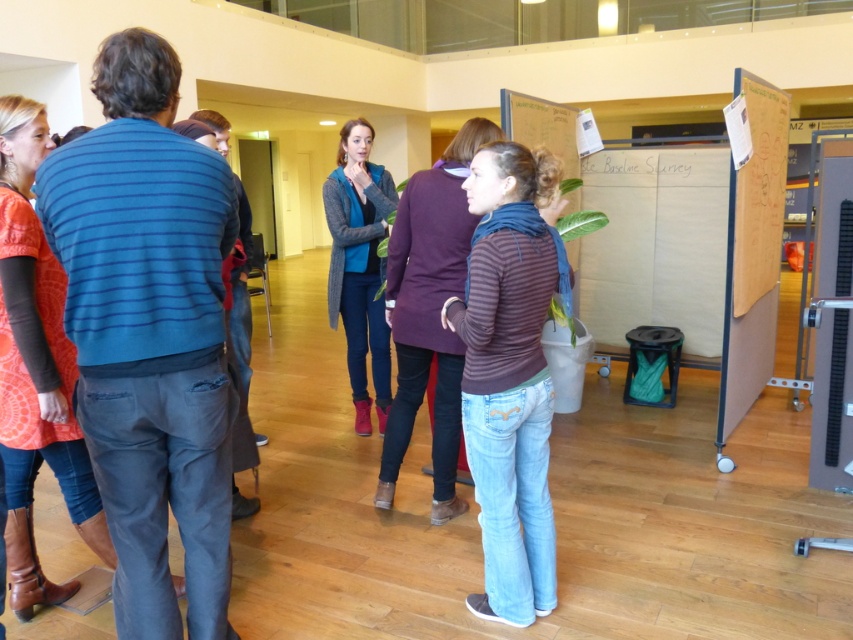
Which is more to the left, striped cotton shirt at center or white cardboard bulletin board at center?

striped cotton shirt at center

Is striped cotton shirt at center to the right of white cardboard bulletin board at center from the viewer's perspective?

Incorrect, striped cotton shirt at center is not on the right side of white cardboard bulletin board at center.

Is point (543, 177) closer to camera compared to point (653, 243)?

Yes, point (543, 177) is in front of point (653, 243).

I want to click on striped cotton shirt at center, so coord(509,376).

Can you confirm if blue striped sweater at left is bigger than knitted sweater at center?

Actually, blue striped sweater at left might be smaller than knitted sweater at center.

Is blue striped sweater at left smaller than knitted sweater at center?

Yes, blue striped sweater at left is smaller than knitted sweater at center.

Does point (109, 150) come behind point (366, 305)?

No, it is in front of (366, 305).

You are a GUI agent. You are given a task and a screenshot of the screen. Output one action in this format:
    pyautogui.click(x=<x>, y=<y>)
    Task: Click on the blue striped sweater at left
    
    Given the screenshot: What is the action you would take?
    pyautogui.click(x=149, y=333)

Between white cardboard bulletin board at center and knitted sweater at center, which one is positioned higher?

white cardboard bulletin board at center is higher up.

Does white cardboard bulletin board at center appear under knitted sweater at center?

No, white cardboard bulletin board at center is not below knitted sweater at center.

This screenshot has height=640, width=853. Describe the element at coordinates (654, 243) in the screenshot. I see `white cardboard bulletin board at center` at that location.

Image resolution: width=853 pixels, height=640 pixels. Find the location of `white cardboard bulletin board at center`. white cardboard bulletin board at center is located at coordinates (654, 243).